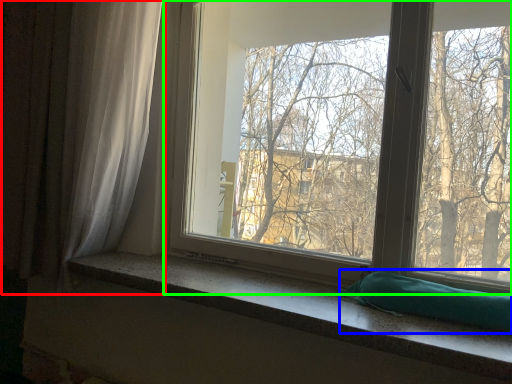
Question: Which object is positioned closest to curtain (highlighted by a red box)? Select from pillow (highlighted by a blue box) and window (highlighted by a green box).

Choices:
 (A) pillow
 (B) window

Answer: (B)